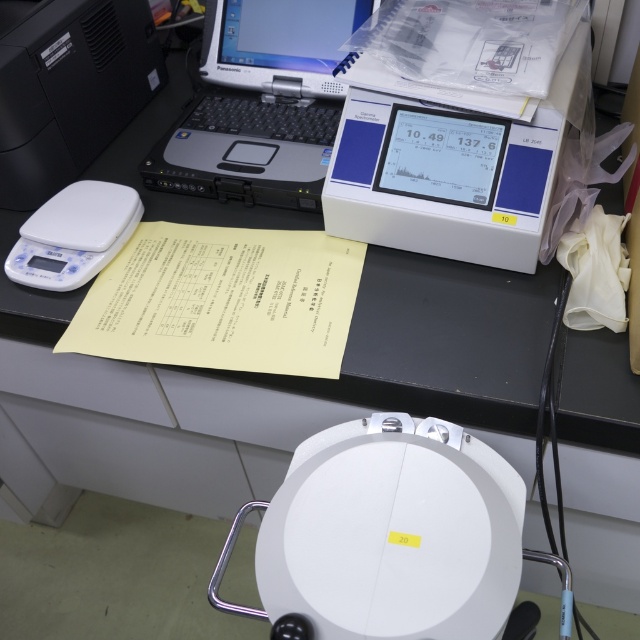
Can you confirm if yellow paper at center is positioned above silver/black plastic laptop at upper center?

No.

Which is behind, point (220, 228) or point (276, 93)?

Point (276, 93)

You are a GUI agent. You are given a task and a screenshot of the screen. Output one action in this format:
    pyautogui.click(x=<x>, y=<y>)
    Task: Click on the yellow paper at center
    The image size is (640, 640).
    Given the screenshot: What is the action you would take?
    pyautogui.click(x=221, y=300)

Does yellow paper at center appear on the right side of white matte scale at left?

Yes, yellow paper at center is to the right of white matte scale at left.

Does yellow paper at center have a lesser height compared to white matte scale at left?

No.

Is point (285, 364) positioned before point (45, 200)?

That is True.

This screenshot has width=640, height=640. Find the location of `yellow paper at center`. yellow paper at center is located at coordinates click(221, 300).

Is silver/black plastic laptop at upper center positioned before black plastic printer at upper left?

No, it is not.

Does point (333, 118) come farther from viewer compared to point (106, 12)?

No.

The height and width of the screenshot is (640, 640). I want to click on silver/black plastic laptop at upper center, so click(260, 104).